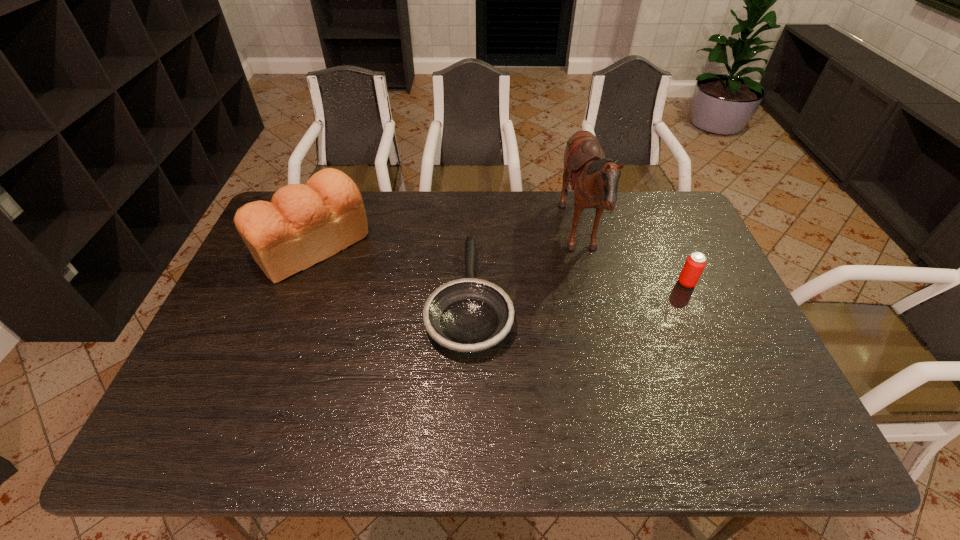
Identify the location of object located in the far left corner section of the desktop. Image resolution: width=960 pixels, height=540 pixels. (304, 224).

Where is `vacant area at the far edge of the desktop`? This screenshot has width=960, height=540. vacant area at the far edge of the desktop is located at coordinates (420, 202).

You are a GUI agent. You are given a task and a screenshot of the screen. Output one action in this format:
    pyautogui.click(x=<x>, y=<y>)
    Task: Click on the vacant space at the near edge of the desktop
    The width and height of the screenshot is (960, 540).
    Given the screenshot: What is the action you would take?
    [344, 429]

Where is `vacant space at the left edge`? vacant space at the left edge is located at coordinates click(x=217, y=373).

At what (x,y) coordinates should I click in order to perform the action: click on free space at the right edge. Please return your answer as a coordinate pair (x, y). Looking at the image, I should click on (674, 285).

Identify the location of free space that is in between the tallest object and the frying pan. Image resolution: width=960 pixels, height=540 pixels. (524, 268).

The width and height of the screenshot is (960, 540). I want to click on free spot between the tallest object and the leftmost object, so click(446, 242).

The width and height of the screenshot is (960, 540). I want to click on empty space that is in between the tallest object and the beer can, so click(633, 260).

What are the coordinates of `free space between the bread and the shortest object` in the screenshot? It's located at tap(391, 272).

At what (x,y) coordinates should I click in order to perform the action: click on vacant space that is in between the beer can and the leftmost object. Please return your answer as a coordinate pair (x, y). The width and height of the screenshot is (960, 540). Looking at the image, I should click on (499, 265).